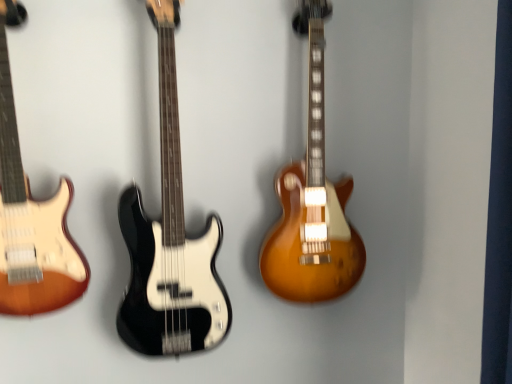
Where is `satin sunburst electric guitar at center, which ranks as the 1th guitar in right-to-left order`? satin sunburst electric guitar at center, which ranks as the 1th guitar in right-to-left order is located at coordinates (312, 200).

What do you see at coordinates (170, 239) in the screenshot? I see `black glossy bass guitar at center, which is the second guitar in left-to-right order` at bounding box center [170, 239].

In order to click on satin sunburst electric guitar at center, the third guitar when ordered from left to right in this screenshot , I will do coord(312,200).

Considering the positions of points (229, 327) and (53, 206), is point (229, 327) closer to camera compared to point (53, 206)?

No, (229, 327) is behind (53, 206).

Looking at their sizes, would you say black glossy bass guitar at center, positioned as the 2th guitar in right-to-left order, is wider or thinner than sunburst wood electric guitar at left, acting as the 3th guitar starting from the right?

black glossy bass guitar at center, positioned as the 2th guitar in right-to-left order, is wider than sunburst wood electric guitar at left, acting as the 3th guitar starting from the right.

Can you tell me how much black glossy bass guitar at center, which is the second guitar in left-to-right order, and sunburst wood electric guitar at left, marked as the 1th guitar in a left-to-right arrangement, differ in facing direction?

There is a 0.313-degree angle between the facing directions of black glossy bass guitar at center, which is the second guitar in left-to-right order, and sunburst wood electric guitar at left, marked as the 1th guitar in a left-to-right arrangement.

From a real-world perspective, is black glossy bass guitar at center, positioned as the 2th guitar in right-to-left order, above or below sunburst wood electric guitar at left, acting as the 3th guitar starting from the right?

black glossy bass guitar at center, positioned as the 2th guitar in right-to-left order, is situated lower than sunburst wood electric guitar at left, acting as the 3th guitar starting from the right, in the real world.

Consider the image. Is black glossy bass guitar at center, which is the second guitar in left-to-right order, situated inside satin sunburst electric guitar at center, which ranks as the 1th guitar in right-to-left order, or outside?

black glossy bass guitar at center, which is the second guitar in left-to-right order, cannot be found inside satin sunburst electric guitar at center, which ranks as the 1th guitar in right-to-left order.

Is black glossy bass guitar at center, positioned as the 2th guitar in right-to-left order, positioned with its back to satin sunburst electric guitar at center, the third guitar when ordered from left to right?

No, black glossy bass guitar at center, positioned as the 2th guitar in right-to-left order,'s orientation is not away from satin sunburst electric guitar at center, the third guitar when ordered from left to right.

From the image's perspective, is black glossy bass guitar at center, positioned as the 2th guitar in right-to-left order, above satin sunburst electric guitar at center, the third guitar when ordered from left to right?

Incorrect, from the image's perspective, black glossy bass guitar at center, positioned as the 2th guitar in right-to-left order, is lower than satin sunburst electric guitar at center, the third guitar when ordered from left to right.

Looking at this image, does black glossy bass guitar at center, positioned as the 2th guitar in right-to-left order, have a lesser height compared to satin sunburst electric guitar at center, the third guitar when ordered from left to right?

No.

Between satin sunburst electric guitar at center, the third guitar when ordered from left to right, and black glossy bass guitar at center, which is the second guitar in left-to-right order, which one has larger width?

Wider between the two is black glossy bass guitar at center, which is the second guitar in left-to-right order.

In the scene shown: Considering the relative positions of satin sunburst electric guitar at center, which ranks as the 1th guitar in right-to-left order, and black glossy bass guitar at center, which is the second guitar in left-to-right order, in the image provided, is satin sunburst electric guitar at center, which ranks as the 1th guitar in right-to-left order, to the left or to the right of black glossy bass guitar at center, which is the second guitar in left-to-right order,?

Clearly, satin sunburst electric guitar at center, which ranks as the 1th guitar in right-to-left order, is on the right of black glossy bass guitar at center, which is the second guitar in left-to-right order, in the image.

Which of these two, satin sunburst electric guitar at center, the third guitar when ordered from left to right, or black glossy bass guitar at center, which is the second guitar in left-to-right order, is bigger?

black glossy bass guitar at center, which is the second guitar in left-to-right order, is bigger.

You are a GUI agent. You are given a task and a screenshot of the screen. Output one action in this format:
    pyautogui.click(x=<x>, y=<y>)
    Task: Click on the 1st guitar located beneath the sunburst wood electric guitar at left, acting as the 3th guitar starting from the right (from a real-world perspective)
    
    Given the screenshot: What is the action you would take?
    pyautogui.click(x=312, y=200)

From a real-world perspective, is satin sunburst electric guitar at center, which ranks as the 1th guitar in right-to-left order, physically located above or below sunburst wood electric guitar at left, acting as the 3th guitar starting from the right?

satin sunburst electric guitar at center, which ranks as the 1th guitar in right-to-left order, is situated lower than sunburst wood electric guitar at left, acting as the 3th guitar starting from the right, in the real world.

Which object is closer to the camera, satin sunburst electric guitar at center, the third guitar when ordered from left to right, or sunburst wood electric guitar at left, acting as the 3th guitar starting from the right?

sunburst wood electric guitar at left, acting as the 3th guitar starting from the right.

How many degrees apart are the facing directions of sunburst wood electric guitar at left, acting as the 3th guitar starting from the right, and satin sunburst electric guitar at center, which ranks as the 1th guitar in right-to-left order?

The angular difference between sunburst wood electric guitar at left, acting as the 3th guitar starting from the right, and satin sunburst electric guitar at center, which ranks as the 1th guitar in right-to-left order, is 2.55 degrees.

Based on the photo, is sunburst wood electric guitar at left, acting as the 3th guitar starting from the right, not close to satin sunburst electric guitar at center, the third guitar when ordered from left to right?

That's not correct — sunburst wood electric guitar at left, acting as the 3th guitar starting from the right, is a little close to satin sunburst electric guitar at center, the third guitar when ordered from left to right.

In the image, is sunburst wood electric guitar at left, marked as the 1th guitar in a left-to-right arrangement, on the left side or the right side of satin sunburst electric guitar at center, which ranks as the 1th guitar in right-to-left order?

sunburst wood electric guitar at left, marked as the 1th guitar in a left-to-right arrangement, is to the left of satin sunburst electric guitar at center, which ranks as the 1th guitar in right-to-left order.

Is sunburst wood electric guitar at left, acting as the 3th guitar starting from the right, in front of satin sunburst electric guitar at center, which ranks as the 1th guitar in right-to-left order?

That is True.

From a real-world perspective, between sunburst wood electric guitar at left, marked as the 1th guitar in a left-to-right arrangement, and black glossy bass guitar at center, which is the second guitar in left-to-right order, who is vertically higher?

sunburst wood electric guitar at left, marked as the 1th guitar in a left-to-right arrangement, from a real-world perspective.

Can you confirm if sunburst wood electric guitar at left, marked as the 1th guitar in a left-to-right arrangement, is smaller than black glossy bass guitar at center, which is the second guitar in left-to-right order?

Yes, sunburst wood electric guitar at left, marked as the 1th guitar in a left-to-right arrangement, is smaller than black glossy bass guitar at center, which is the second guitar in left-to-right order.

Which object is further away from the camera, sunburst wood electric guitar at left, marked as the 1th guitar in a left-to-right arrangement, or black glossy bass guitar at center, which is the second guitar in left-to-right order?

black glossy bass guitar at center, which is the second guitar in left-to-right order, is further away from the camera.

From the image's perspective, is sunburst wood electric guitar at left, marked as the 1th guitar in a left-to-right arrangement, over black glossy bass guitar at center, positioned as the 2th guitar in right-to-left order?

Indeed, from the image's perspective, sunburst wood electric guitar at left, marked as the 1th guitar in a left-to-right arrangement, is shown above black glossy bass guitar at center, positioned as the 2th guitar in right-to-left order.

Find the location of a particular element. the 1st guitar behind the sunburst wood electric guitar at left, acting as the 3th guitar starting from the right, starting your count from the anchor is located at coordinates (170, 239).

At what (x,y) coordinates should I click in order to perform the action: click on guitar that appears on the right of black glossy bass guitar at center, positioned as the 2th guitar in right-to-left order. Please return your answer as a coordinate pair (x, y). The width and height of the screenshot is (512, 384). Looking at the image, I should click on (312, 200).

Based on their spatial positions, is black glossy bass guitar at center, positioned as the 2th guitar in right-to-left order, or sunburst wood electric guitar at left, marked as the 1th guitar in a left-to-right arrangement, closer to satin sunburst electric guitar at center, the third guitar when ordered from left to right?

Based on the image, black glossy bass guitar at center, positioned as the 2th guitar in right-to-left order, appears to be nearer to satin sunburst electric guitar at center, the third guitar when ordered from left to right.

Estimate the real-world distances between objects in this image. Which object is closer to sunburst wood electric guitar at left, acting as the 3th guitar starting from the right, black glossy bass guitar at center, which is the second guitar in left-to-right order, or satin sunburst electric guitar at center, which ranks as the 1th guitar in right-to-left order?

Based on the image, black glossy bass guitar at center, which is the second guitar in left-to-right order, appears to be nearer to sunburst wood electric guitar at left, acting as the 3th guitar starting from the right.

Considering their positions, is sunburst wood electric guitar at left, acting as the 3th guitar starting from the right, positioned closer to satin sunburst electric guitar at center, the third guitar when ordered from left to right, than black glossy bass guitar at center, positioned as the 2th guitar in right-to-left order?

The object closer to satin sunburst electric guitar at center, the third guitar when ordered from left to right, is black glossy bass guitar at center, positioned as the 2th guitar in right-to-left order.

Estimate the real-world distances between objects in this image. Which object is closer to sunburst wood electric guitar at left, acting as the 3th guitar starting from the right, satin sunburst electric guitar at center, which ranks as the 1th guitar in right-to-left order, or black glossy bass guitar at center, positioned as the 2th guitar in right-to-left order?

black glossy bass guitar at center, positioned as the 2th guitar in right-to-left order, lies closer to sunburst wood electric guitar at left, acting as the 3th guitar starting from the right, than the other object.

When comparing their distances from black glossy bass guitar at center, which is the second guitar in left-to-right order, does satin sunburst electric guitar at center, the third guitar when ordered from left to right, or sunburst wood electric guitar at left, marked as the 1th guitar in a left-to-right arrangement, seem further?

Among the two, satin sunburst electric guitar at center, the third guitar when ordered from left to right, is located further to black glossy bass guitar at center, which is the second guitar in left-to-right order.

Consider the image. Considering their positions, is sunburst wood electric guitar at left, marked as the 1th guitar in a left-to-right arrangement, positioned closer to black glossy bass guitar at center, positioned as the 2th guitar in right-to-left order, than satin sunburst electric guitar at center, which ranks as the 1th guitar in right-to-left order?

Result: sunburst wood electric guitar at left, marked as the 1th guitar in a left-to-right arrangement, lies closer to black glossy bass guitar at center, positioned as the 2th guitar in right-to-left order, than the other object.

The image size is (512, 384). Identify the location of guitar between sunburst wood electric guitar at left, acting as the 3th guitar starting from the right, and satin sunburst electric guitar at center, which ranks as the 1th guitar in right-to-left order, from left to right. (x=170, y=239).